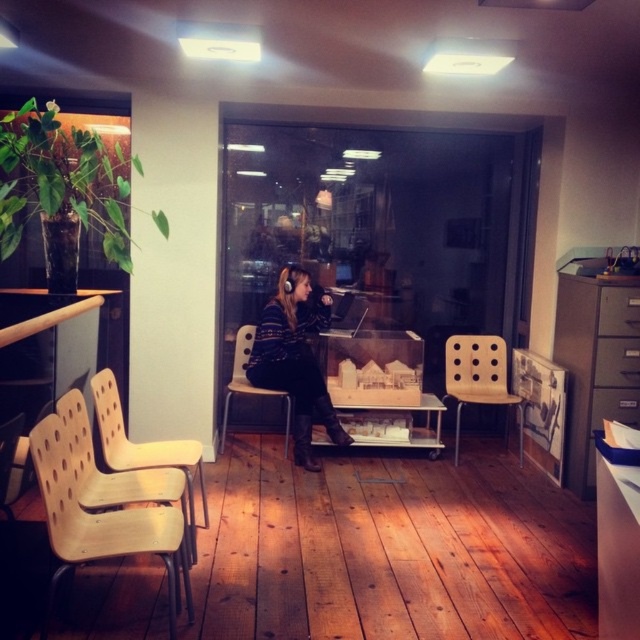
You are sitting in the wooden perforated chair at center and want to reach the light brown wooden chair at right. Is it possible to move directly to it without moving any objects?

The light brown wooden chair at right is in front of the wooden perforated chair at center, so you are already positioned behind it. To reach the light brown wooden chair at right, you would need to move around or behind the wooden perforated chair at center.

Looking at this image, you are standing in the room and need to move from the light brown wooden chair at right to the large potted plant on the left shelf. Based on their positions, which direction should you move to reach the plant?

The light brown wooden chair at right is located at point [477,378], so to reach the large potted plant on the left shelf, you should move towards the left direction from the light brown wooden chair at right.